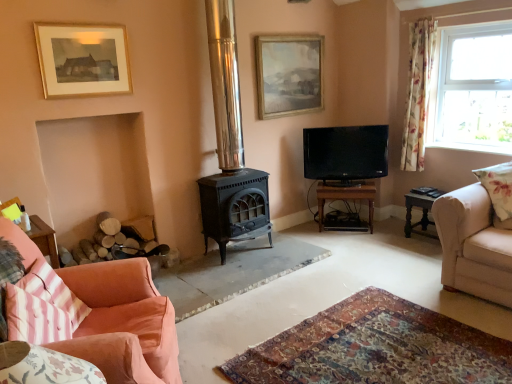
Question: Based on their positions, is beige fabric couch at right, arranged as the second studio couch when viewed from the left, located to the left or right of dark gray wooden side table at right, positioned as the second table in left-to-right order?

Choices:
 (A) left
 (B) right

Answer: (B)

Question: In terms of height, does beige fabric couch at right, which is the first studio couch from right to left, look taller or shorter compared to dark gray wooden side table at right, the 1th table when ordered from right to left?

Choices:
 (A) tall
 (B) short

Answer: (A)

Question: Which object is the farthest from the black glossy tv at center?

Choices:
 (A) brown wooden table at center, the second table when ordered from right to left
 (B) wooden picture frame at upper center, which ranks as the first picture frame in back-to-front order
 (C) black cast iron stove at center
 (D) clear glass window at upper right
 (E) pink striped cushion at lower left, which appears as the 2th pillow when viewed from the right

Answer: (E)

Question: Considering the real-world distances, which object is closest to the clear glass window at upper right?

Choices:
 (A) wooden picture frame at upper center, which ranks as the first picture frame in back-to-front order
 (B) floral fabric curtain at right
 (C) dark gray wooden side table at right, positioned as the second table in left-to-right order
 (D) pink striped cushion at lower left, which appears as the 2th pillow when viewed from the right
 (E) pink fabric couch at lower left, the 2th studio couch positioned from the right

Answer: (B)